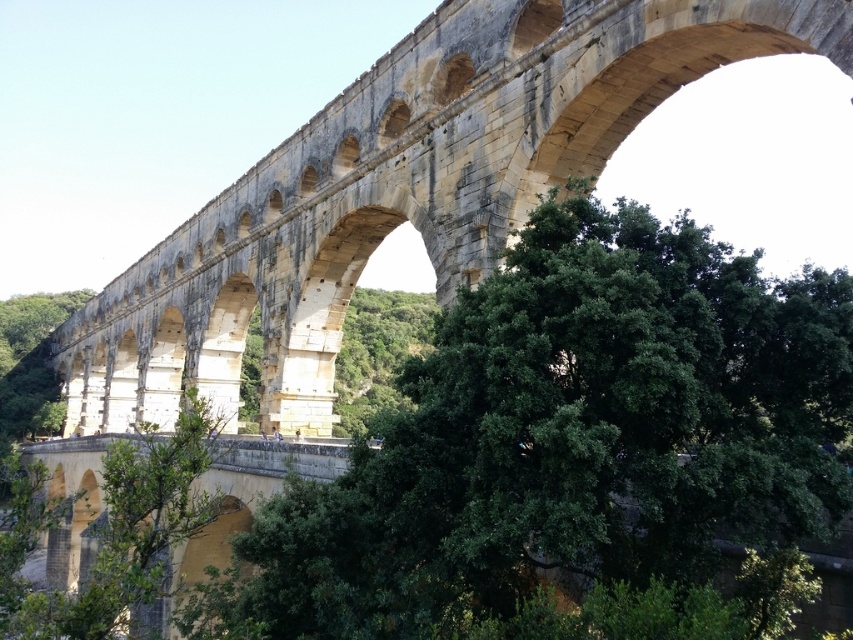
You are standing at the base of the ancient stone aqueduct and notice a green leafy tree at center. Based on its position, can you determine if the tree is closer to you or further away compared to the aqueduct?

The green leafy tree at center is located at point coordinates of (573, 435), which places it in the foreground of the scene. Since the aqueduct is the main structure in the background, the tree is closer to you than the aqueduct.

You are a tourist standing at the base of the stone arch bridge at center and want to take a photo of the green leafy tree at center. Since the tree is shorter than the bridge, where should you position yourself to ensure the entire tree is visible in your photo?

Since the green leafy tree at center is shorter than the stone arch bridge at center, positioning yourself at a lower angle or closer to the base of the tree will ensure the entire tree is visible in your photo without the bridge obstructing the view.

You are a photographer planning to capture the stone arch bridge at center and the green leafy tree at center in a single frame. Based on their sizes in the image, which object should you focus on to ensure both fit comfortably within the shot?

The green leafy tree at center occupies less space than the stone arch bridge at center, so focusing on the stone arch bridge at center will allow both objects to fit comfortably within the frame since it is the larger of the two.